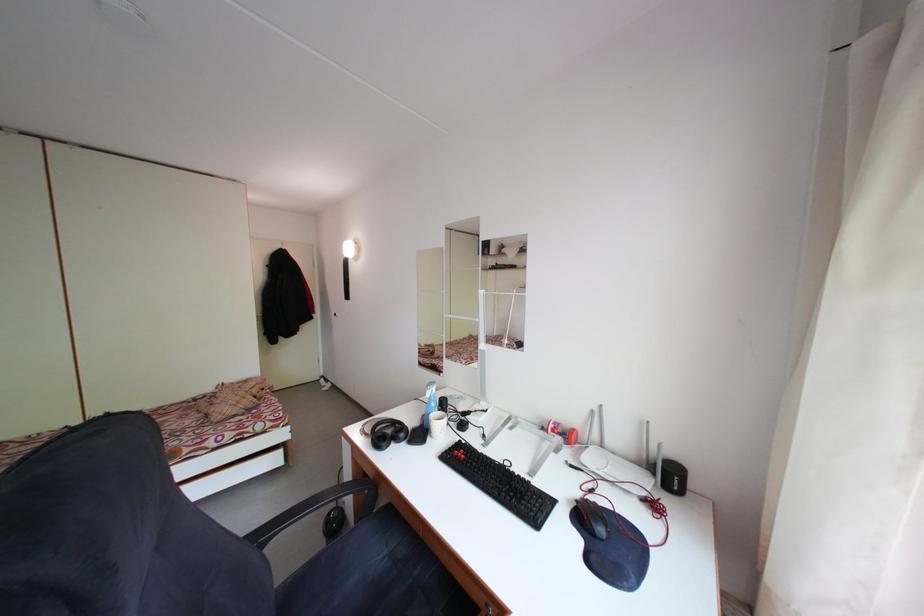
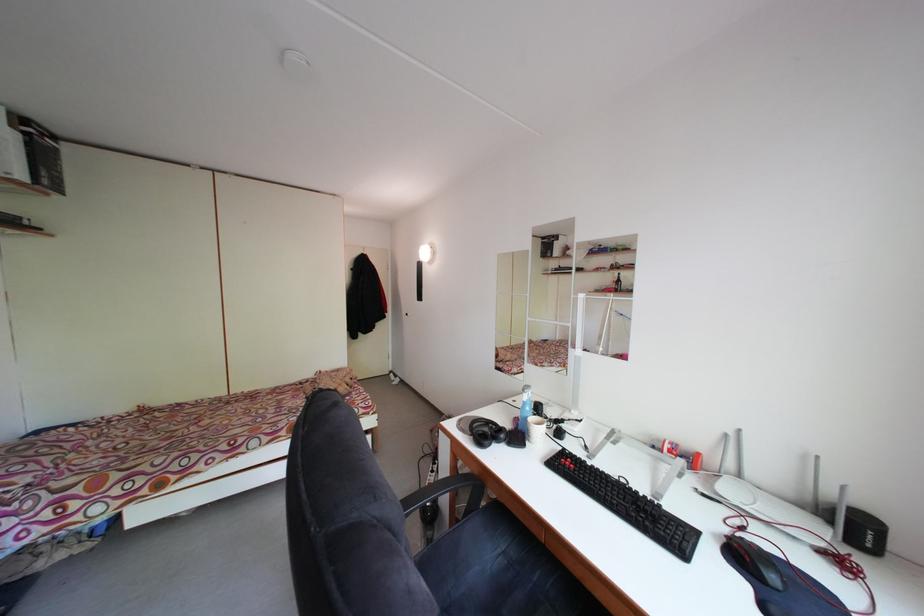
In the second image, find the point that corresponds to point 588,501 in the first image.

(735, 536)